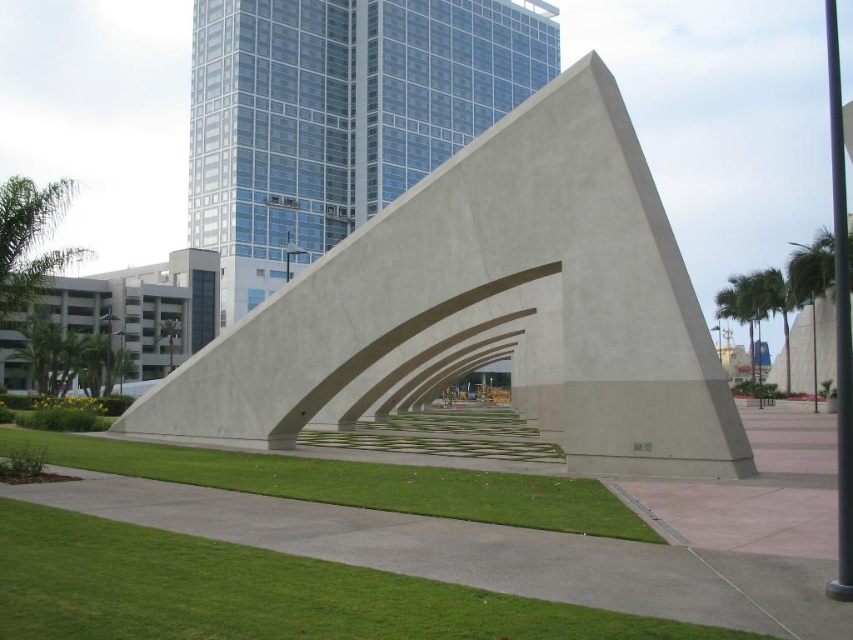
Question: Does smooth concrete sculpture at center have a larger size compared to green grass at lower left?

Choices:
 (A) no
 (B) yes

Answer: (B)

Question: Is smooth concrete sculpture at center below sleek glass skyscraper at upper center?

Choices:
 (A) yes
 (B) no

Answer: (A)

Question: Which of the following is the farthest from the observer?

Choices:
 (A) (305, 56)
 (B) (480, 512)
 (C) (514, 147)
 (D) (473, 611)

Answer: (A)

Question: Which object is closer to the camera taking this photo?

Choices:
 (A) smooth concrete sculpture at center
 (B) sleek glass skyscraper at upper center
 (C) green grass at lower left
 (D) green grass at center

Answer: (C)

Question: Which object appears closest to the camera in this image?

Choices:
 (A) green grass at lower left
 (B) smooth concrete sculpture at center
 (C) sleek glass skyscraper at upper center

Answer: (A)

Question: Does smooth concrete sculpture at center have a greater width compared to sleek glass skyscraper at upper center?

Choices:
 (A) no
 (B) yes

Answer: (A)